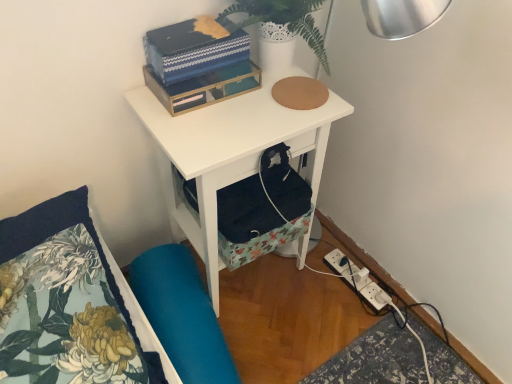
Image resolution: width=512 pixels, height=384 pixels. Identify the location of unoccupied region to the right of white plastic power strip at lower right. (391, 295).